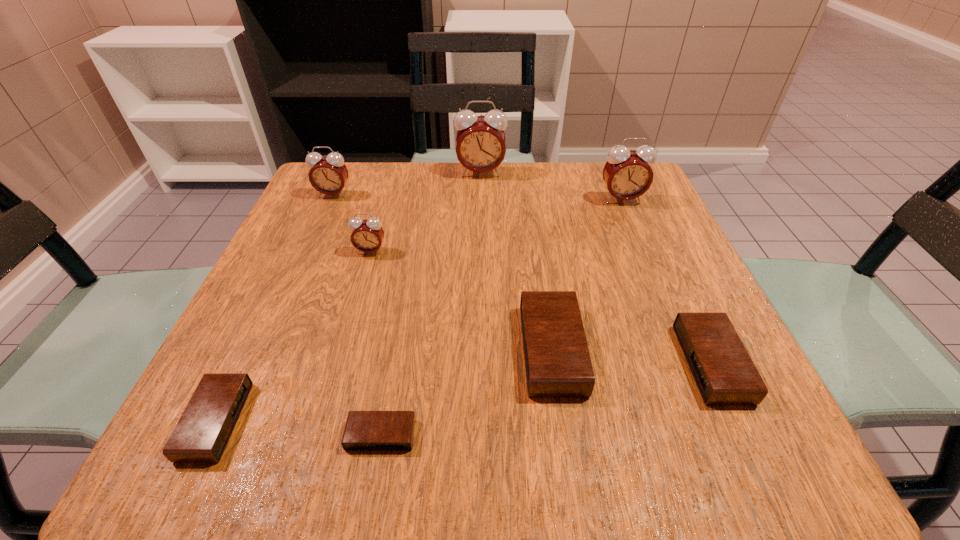
Find the location of a particular element. The image size is (960, 540). free space located 0.070m on the front face of the biggest black alarm clock is located at coordinates (480, 349).

The image size is (960, 540). I want to click on free space located 0.380m on the front face of the biggest black alarm clock, so click(285, 349).

This screenshot has width=960, height=540. I want to click on vacant space located 0.350m on the front face of the biggest black alarm clock, so click(x=304, y=349).

Where is `vacant space situated 0.140m on the front face of the third shortest alarm clock`? This screenshot has width=960, height=540. vacant space situated 0.140m on the front face of the third shortest alarm clock is located at coordinates (597, 363).

What are the coordinates of `vacant region located 0.380m on the front face of the third shortest alarm clock` in the screenshot? It's located at pos(442,363).

Where is `blank space located on the front face of the third shortest alarm clock`? This screenshot has width=960, height=540. blank space located on the front face of the third shortest alarm clock is located at coordinates (533, 363).

At what (x,y) coordinates should I click in order to perform the action: click on vacant space situated 0.270m on the front face of the second shortest object. Please return your answer as a coordinate pair (x, y). This screenshot has width=960, height=540. Looking at the image, I should click on (432, 421).

Where is `object at the far left corner`? object at the far left corner is located at coordinates (329, 174).

Identify the location of object positioned at the near left corner. This screenshot has height=540, width=960. (202, 433).

Find the location of a particular element. This screenshot has width=960, height=540. object that is at the far right corner is located at coordinates (627, 174).